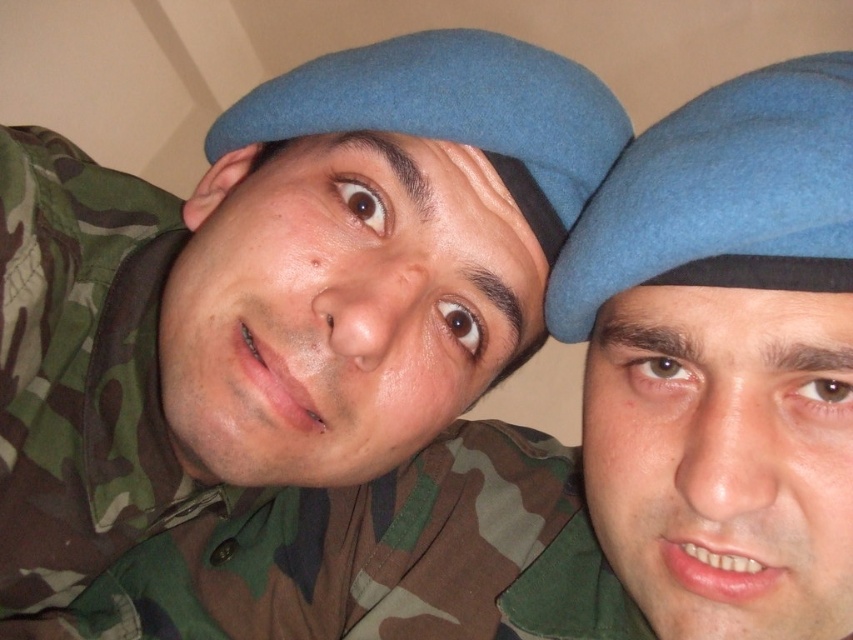
Question: Among these objects, which one is nearest to the camera?

Choices:
 (A) matte blue beret at center
 (B) matte blue beret at upper center

Answer: (B)

Question: Considering the relative positions of blue felt beret at upper right and matte blue beret at center in the image provided, where is blue felt beret at upper right located with respect to matte blue beret at center?

Choices:
 (A) above
 (B) below

Answer: (B)

Question: Does blue felt beret at upper right lie behind matte blue beret at center?

Choices:
 (A) yes
 (B) no

Answer: (B)

Question: Which of these objects is positioned farthest from the blue felt beret at center?

Choices:
 (A) blue felt beret at upper right
 (B) matte blue beret at center
 (C) matte blue beret at upper center

Answer: (C)

Question: In this image, where is matte blue beret at upper center located relative to blue felt beret at upper right?

Choices:
 (A) left
 (B) right

Answer: (A)

Question: Which of these objects is positioned farthest from the blue felt beret at upper right?

Choices:
 (A) blue felt beret at center
 (B) matte blue beret at center

Answer: (B)